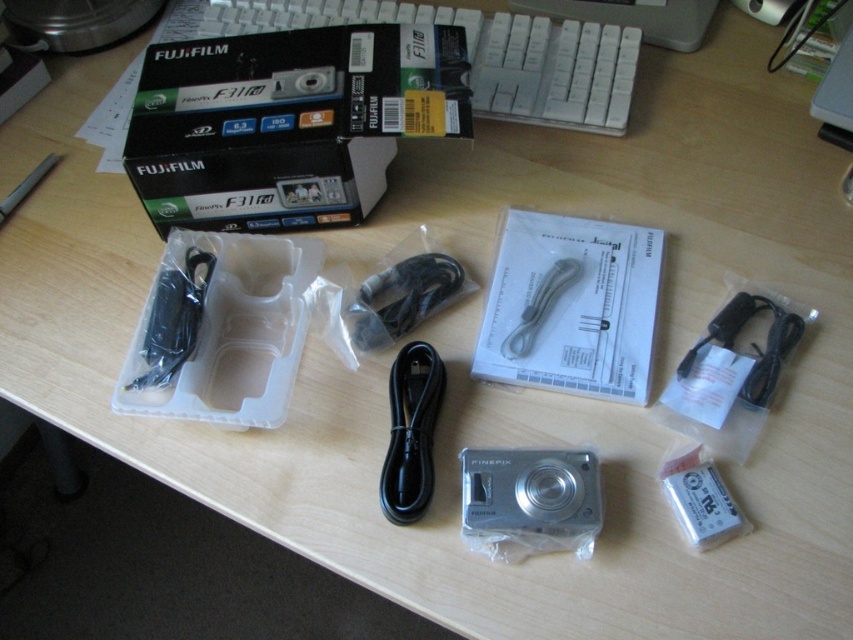
You are setting up a new camera on a desk. You have a white plastic keyboard at upper center and a silver metallic camera at center. Which object is located higher up on the desk?

The white plastic keyboard at upper center is located higher up on the desk than the silver metallic camera at center because it is positioned above it.

You are holding a silver metallic camera at center and a black plastic charger at right. Which object is thinner?

The silver metallic camera at center is thinner than the black plastic charger at right.